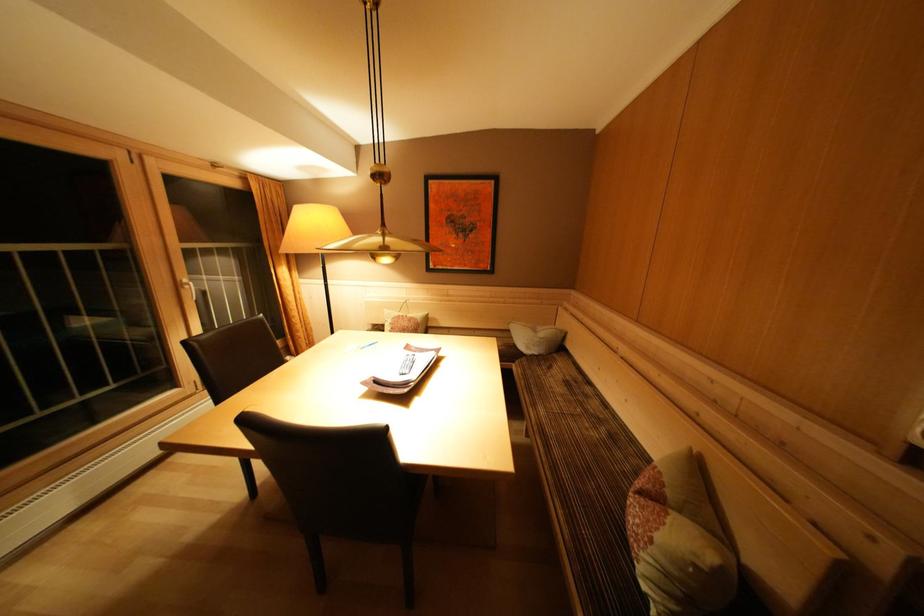
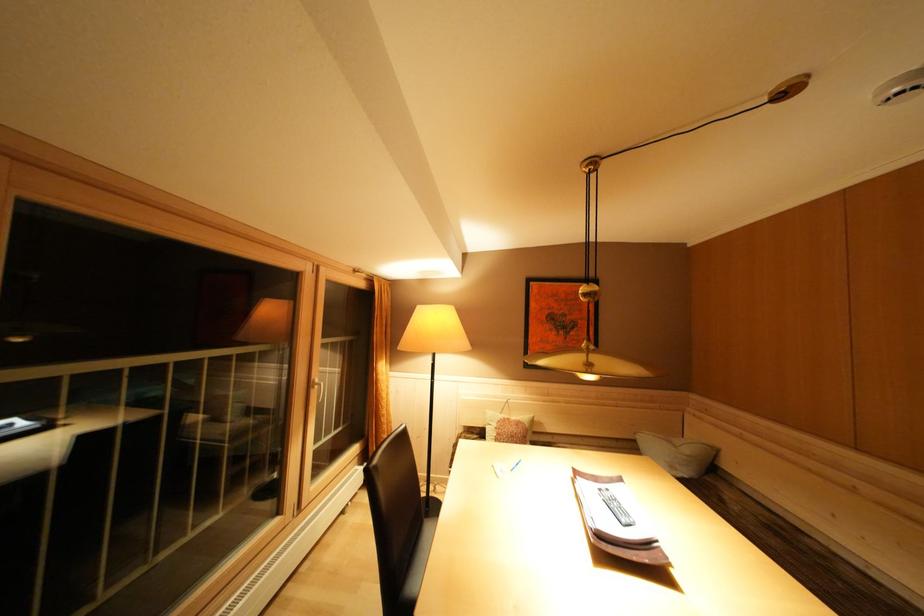
Question: Based on the continuous images, in which direction is the camera rotating? Reply with the corresponding letter.

Choices:
 (A) Left
 (B) Right
 (C) Up
 (D) Down

Answer: (C)